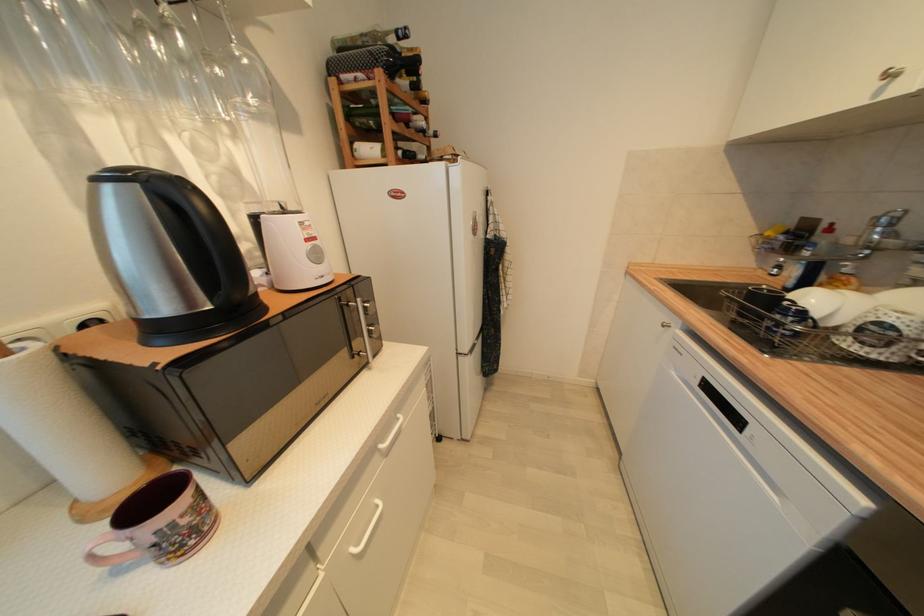
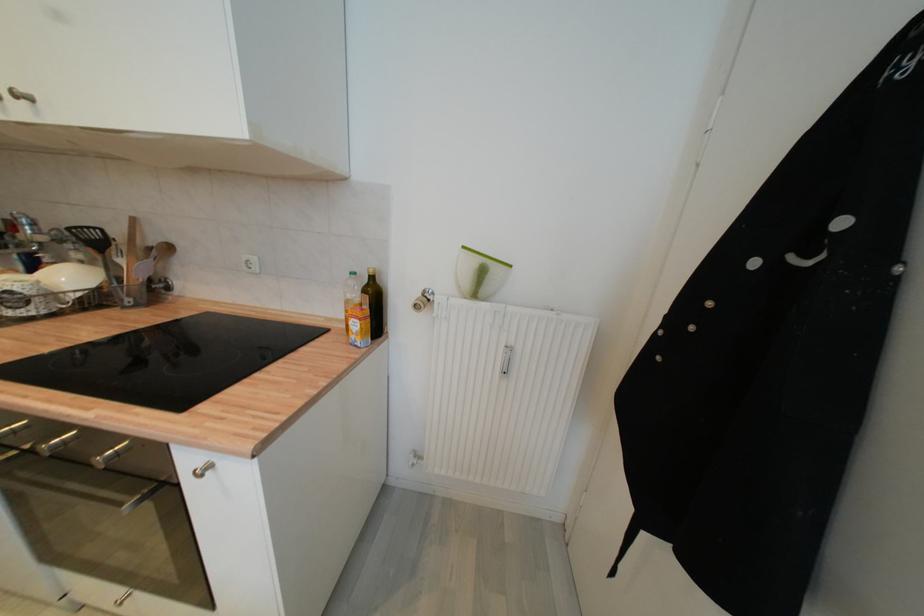
Based on the continuous images, in which direction is the camera rotating?

The rotation direction of the camera is right-down.